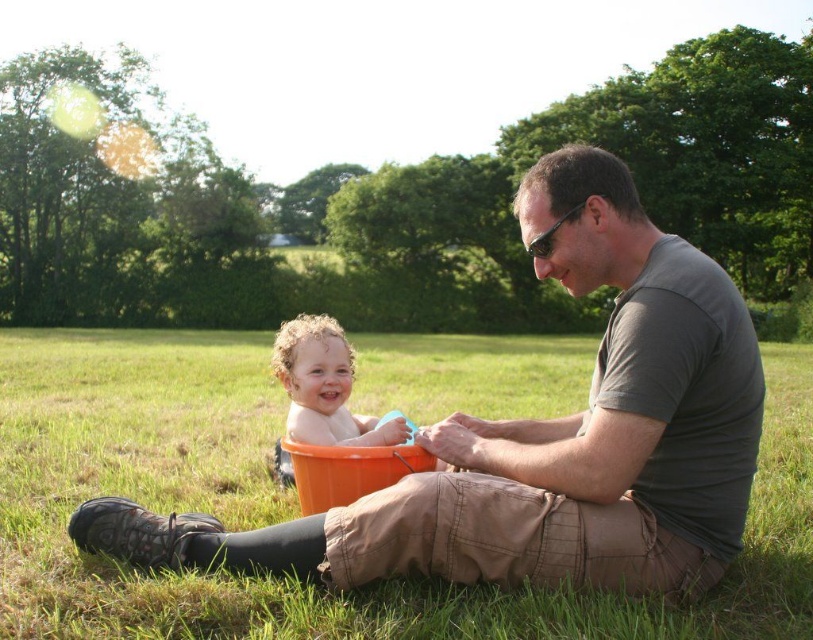
You are planning to lay a picnic blanket in the grassy area where the green grass at center and curly blonde hair at center are located. Considering their widths, which object takes up more horizontal space in the scene?

The green grass at center takes up more horizontal space than the curly blonde hair at center because its width surpasses that of the curly blonde hair at center.

You are a photographer trying to capture a clear shot of the curly blonde hair at center and the green grass at center. Which object should you focus on to ensure it appears sharp in the photo?

The curly blonde hair at center is shorter than the green grass at center, so focusing on the green grass at center will ensure both are sharp as they are at the same distance but the grass is taller.

You are standing in the park and see the green grass at center and curly blonde hair at center. Which object is located to the right of the other?

The green grass at center is to the right of curly blonde hair at center.